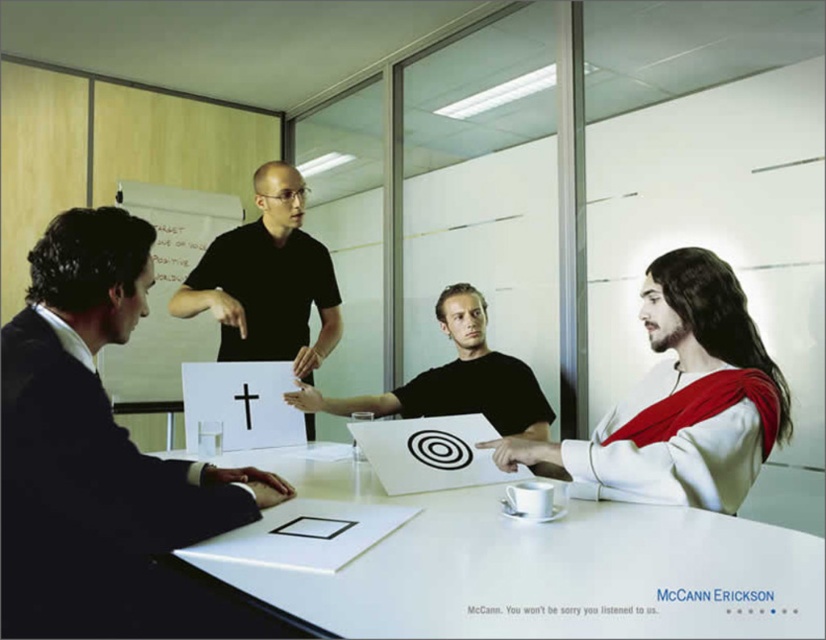
Based on the photo, you are an office worker who needs to place a new monitor on the desk. The monitor must be placed in front of the white matte jesus at right. Is the white glossy table at center suitable for this task?

The white glossy table at center is in front of the white matte jesus at right, so placing the monitor on the white glossy table at center would position it in front of the white matte jesus at right. Therefore, the white glossy table at center is suitable for this task.

In the scene shown: You are an office worker who needs to place a 15 cm tall paperweight on the table. The white glossy table at center and the white matte jesus at right are both available. Which surface can safely hold the paperweight without it falling off?

The white matte jesus at right is taller than the white glossy table at center, so placing the paperweight on the white glossy table at center would be safer as it is shorter and more stable.